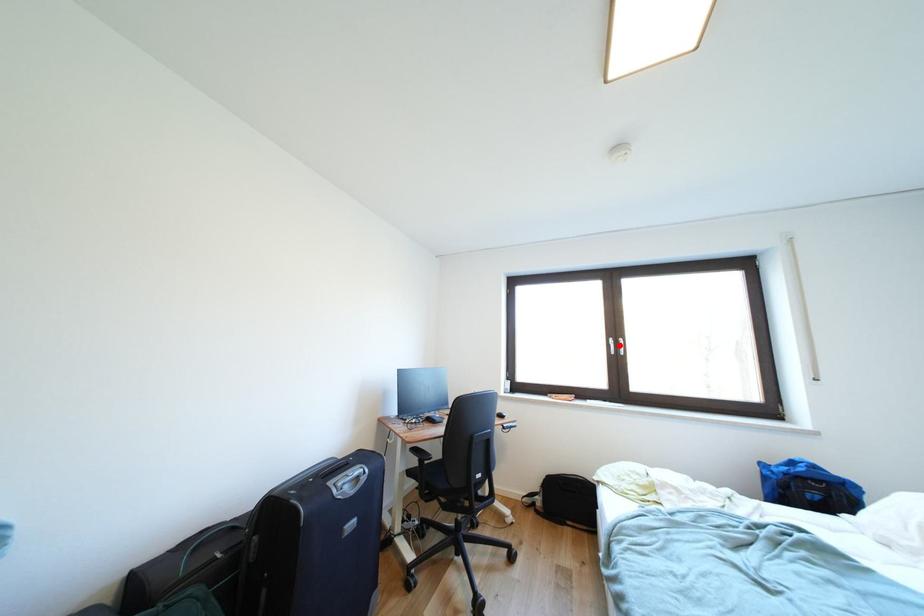
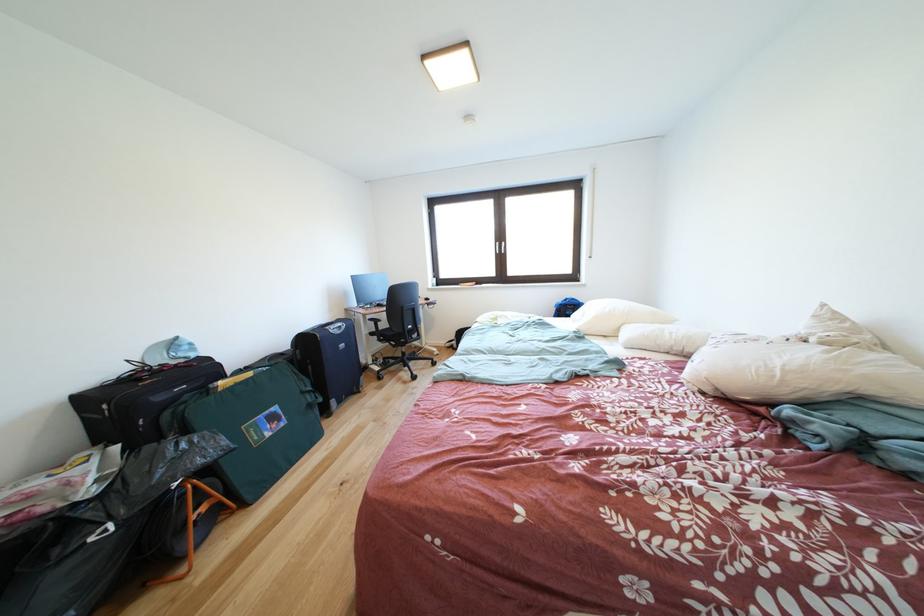
Question: I am providing you with two images of the same scene from different viewpoints. A red point is marked on the first image. Can you still see the location of the red point in image 2?

Choices:
 (A) Yes
 (B) No

Answer: (A)